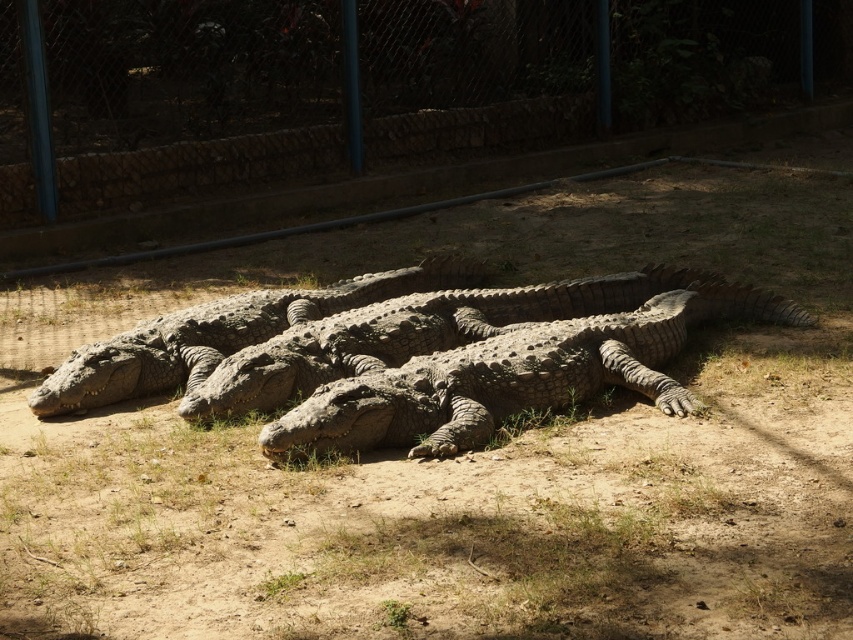
Question: Is rough textured crocodile at center positioned before gray textured crocodile at center?

Choices:
 (A) yes
 (B) no

Answer: (A)

Question: Which object is closer to the camera taking this photo?

Choices:
 (A) rough textured crocodile at center
 (B) metal fence at upper center
 (C) gray textured crocodile at center

Answer: (A)

Question: Is metal fence at upper center positioned behind rough textured crocodile at center?

Choices:
 (A) yes
 (B) no

Answer: (A)

Question: Is rough textured crocodile at center smaller than gray textured crocodile at center?

Choices:
 (A) yes
 (B) no

Answer: (B)

Question: Which point is farther to the camera?

Choices:
 (A) (764, 292)
 (B) (120, 358)
 (C) (840, 4)

Answer: (C)

Question: Estimate the real-world distances between objects in this image. Which object is farther from the gray textured crocodile at center?

Choices:
 (A) metal fence at upper center
 (B) rough textured crocodile at center

Answer: (A)